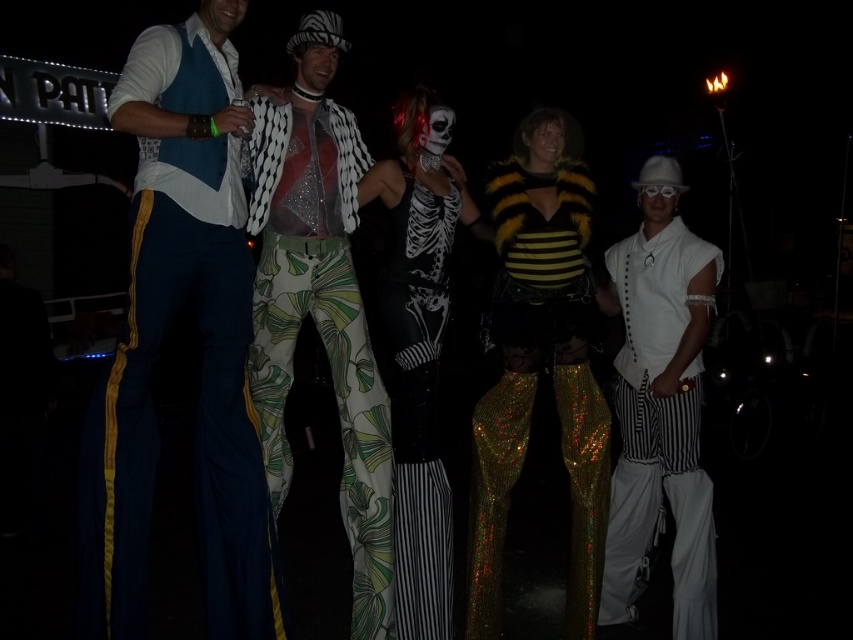
Question: Which of the following is the farthest from the observer?

Choices:
 (A) matte blue pants at left
 (B) matte black skeleton costume at center
 (C) yellow sequined pants at center
 (D) matte white face at upper center

Answer: (C)

Question: Estimate the real-world distances between objects in this image. Which object is closer to the shiny sequined pants at center?

Choices:
 (A) white matte face at center
 (B) matte blue pants at left
 (C) white matte shirt at center

Answer: (B)

Question: Is matte black mask at center thinner than white matte skull mask at center?

Choices:
 (A) yes
 (B) no

Answer: (B)

Question: Is matte blue pants at left to the right of matte black mask at center from the viewer's perspective?

Choices:
 (A) no
 (B) yes

Answer: (A)

Question: Which object is closer to the camera taking this photo?

Choices:
 (A) white matte shirt at center
 (B) matte blue pants at left

Answer: (B)

Question: Is yellow sequined pants at center above matte black mask at center?

Choices:
 (A) no
 (B) yes

Answer: (A)